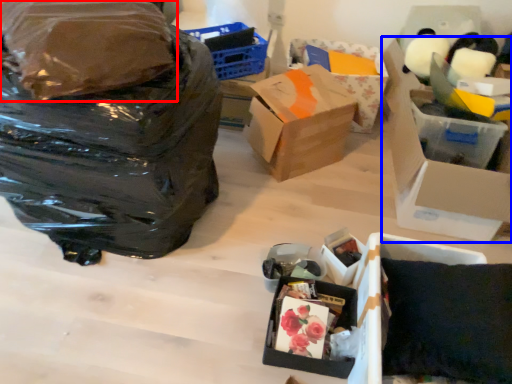
Question: Which point is further to the camera, plastic bag (highlighted by a red box) or box (highlighted by a blue box)?

Choices:
 (A) plastic bag
 (B) box

Answer: (B)